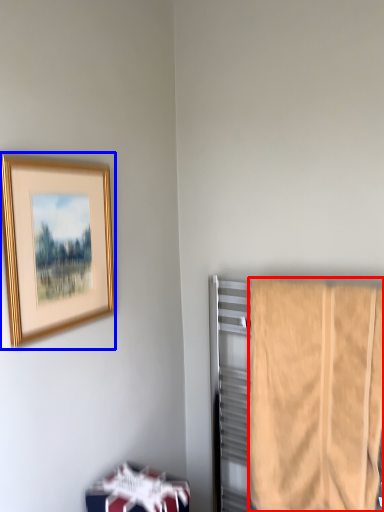
Question: Which point is closer to the camera, towel (highlighted by a red box) or picture frame (highlighted by a blue box)?

Choices:
 (A) towel
 (B) picture frame

Answer: (B)